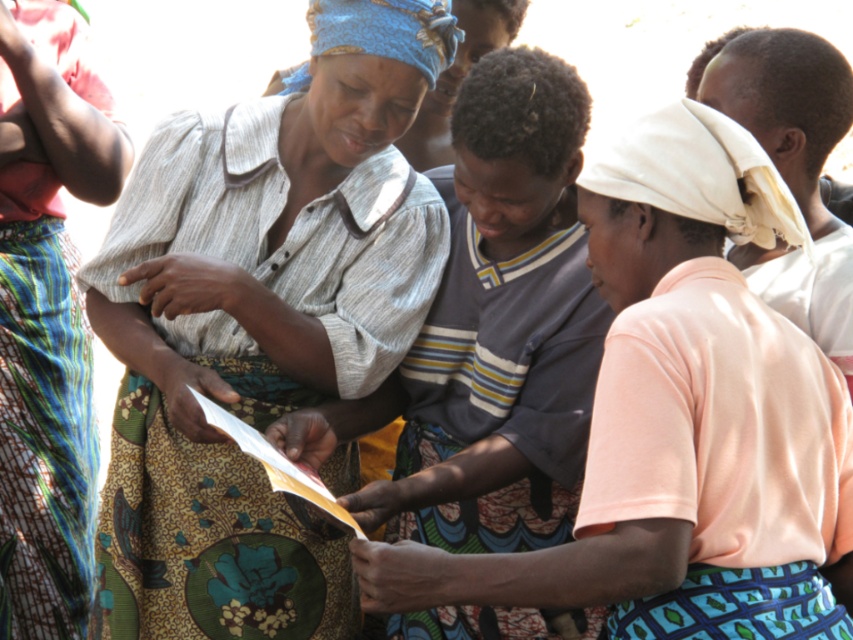
Which is in front, point (216, 200) or point (39, 502)?

Point (216, 200) is in front.

Between matte gray shirt at center and printed fabric skirt at left, which one is positioned lower?

matte gray shirt at center is lower down.

This screenshot has width=853, height=640. What are the coordinates of `matte gray shirt at center` in the screenshot? It's located at (259, 323).

Who is taller, matte gray shirt at center or striped cotton shirt at center?

matte gray shirt at center

In order to click on matte gray shirt at center in this screenshot , I will do `click(259, 323)`.

Which is in front, point (570, 192) or point (51, 243)?

Point (570, 192) is in front.

Who is more forward, (515, 136) or (71, 342)?

Point (515, 136)

In order to click on striped cotton shirt at center in this screenshot , I will do `click(502, 324)`.